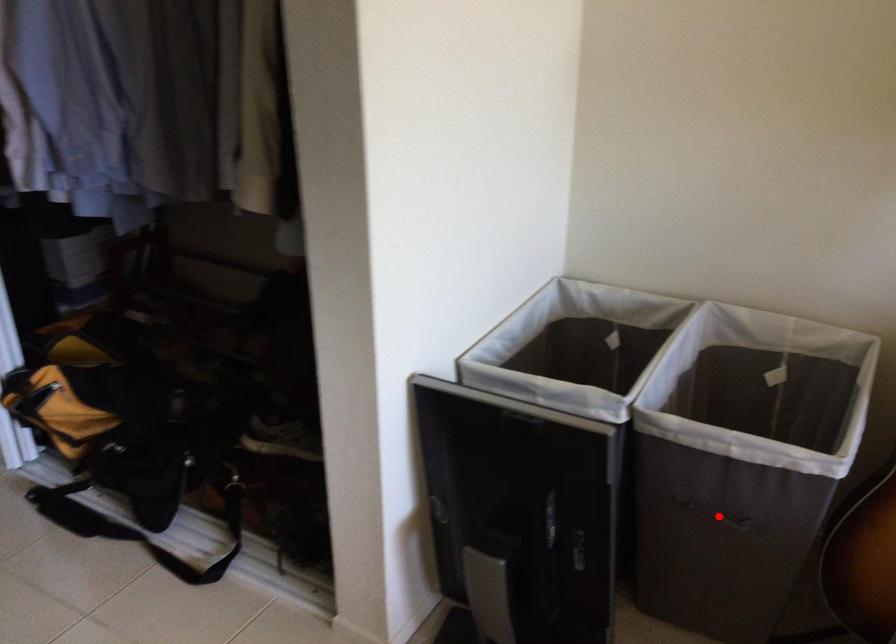
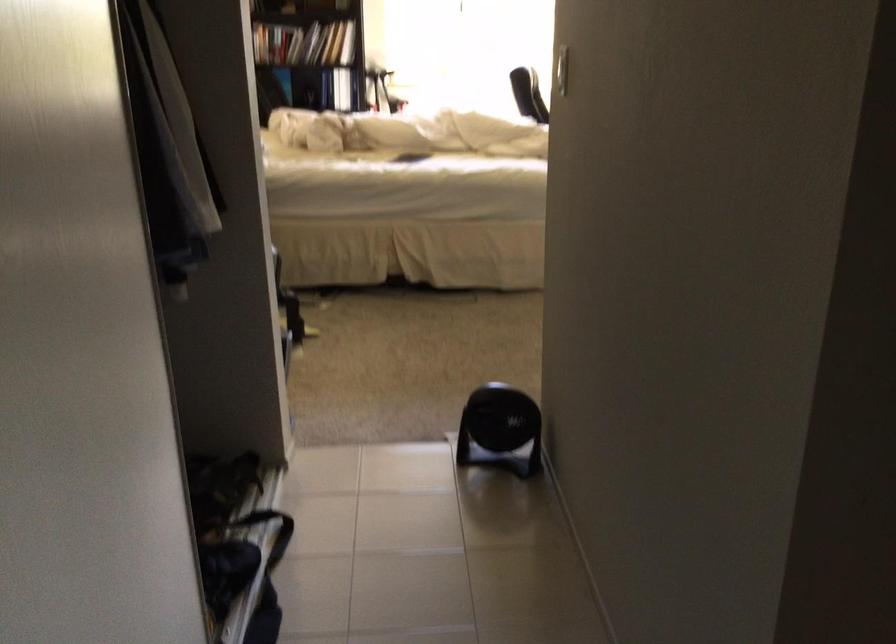
Question: I am providing you with two images of the same scene from different viewpoints. A red point is marked on the first image. Can you still see the location of the red point in image 2?

Choices:
 (A) Yes
 (B) No

Answer: (B)